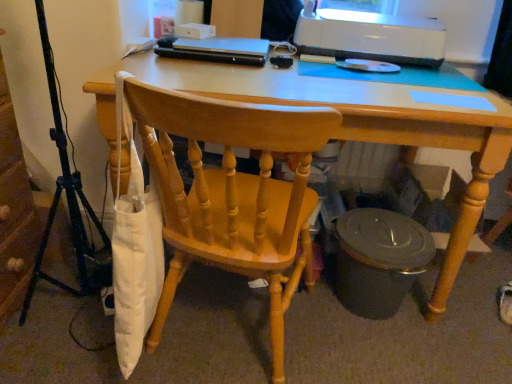
Question: Can you confirm if light wood desk at center is positioned to the right of white glossy printer at upper right?

Choices:
 (A) yes
 (B) no

Answer: (B)

Question: Is white glossy printer at upper right at the back of light wood desk at center?

Choices:
 (A) no
 (B) yes

Answer: (A)

Question: Can you confirm if light wood desk at center is shorter than white glossy printer at upper right?

Choices:
 (A) no
 (B) yes

Answer: (A)

Question: Can you confirm if light wood desk at center is wider than white glossy printer at upper right?

Choices:
 (A) no
 (B) yes

Answer: (B)

Question: Would you say white glossy printer at upper right is part of light wood desk at center's contents?

Choices:
 (A) no
 (B) yes

Answer: (A)

Question: Does light wood desk at center have a larger size compared to white glossy printer at upper right?

Choices:
 (A) yes
 (B) no

Answer: (A)

Question: Is metallic tripod at left at the left side of white glossy printer at upper right?

Choices:
 (A) no
 (B) yes

Answer: (B)

Question: Is metallic tripod at left behind white glossy printer at upper right?

Choices:
 (A) no
 (B) yes

Answer: (A)

Question: Is metallic tripod at left shorter than white glossy printer at upper right?

Choices:
 (A) no
 (B) yes

Answer: (A)

Question: Would you say metallic tripod at left contains white glossy printer at upper right?

Choices:
 (A) yes
 (B) no

Answer: (B)

Question: Can you confirm if metallic tripod at left is taller than white glossy printer at upper right?

Choices:
 (A) yes
 (B) no

Answer: (A)

Question: Considering the relative positions of metallic tripod at left and white glossy printer at upper right in the image provided, is metallic tripod at left in front of white glossy printer at upper right?

Choices:
 (A) no
 (B) yes

Answer: (B)

Question: Could you tell me if metallic tripod at left is turned towards matte black trash can at lower right?

Choices:
 (A) yes
 (B) no

Answer: (A)